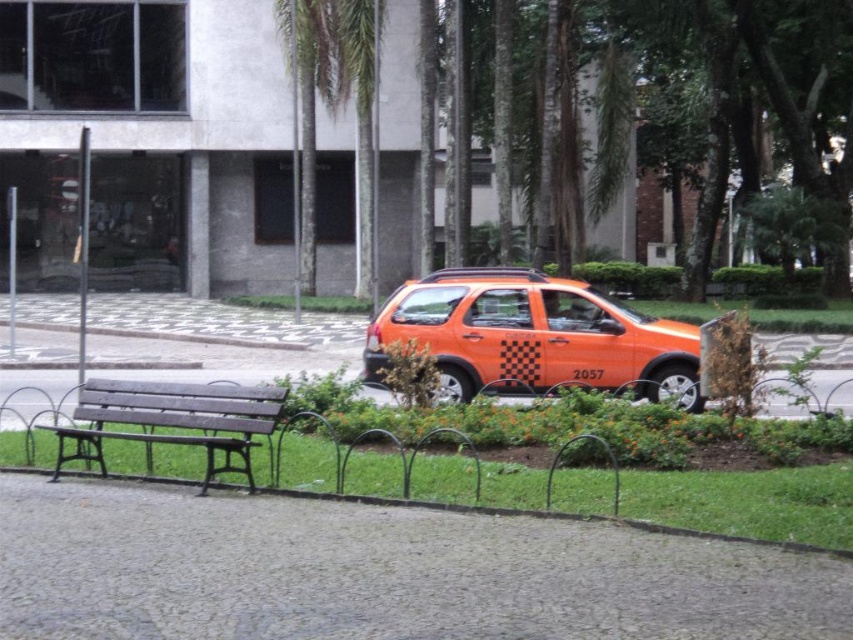
Can you confirm if orange matte car at center is positioned to the right of wooden bench at center?

Correct, you'll find orange matte car at center to the right of wooden bench at center.

Is point (746, 525) positioned before point (238, 413)?

Yes, it is.

This screenshot has width=853, height=640. I want to click on orange matte car at center, so click(498, 452).

Can you confirm if orange matte taxi at center is bigger than wooden bench at center?

Yes, orange matte taxi at center is bigger than wooden bench at center.

At what (x,y) coordinates should I click in order to perform the action: click on orange matte taxi at center. Please return your answer as a coordinate pair (x, y). Looking at the image, I should click on (532, 337).

Can you confirm if orange matte car at center is positioned to the left of orange matte taxi at center?

No, orange matte car at center is not to the left of orange matte taxi at center.

Consider the image. Is orange matte car at center behind orange matte taxi at center?

No, it is not.

Does point (149, 468) come in front of point (531, 358)?

Yes.

At what (x,y) coordinates should I click in order to perform the action: click on orange matte car at center. Please return your answer as a coordinate pair (x, y). This screenshot has height=640, width=853. Looking at the image, I should click on (498, 452).